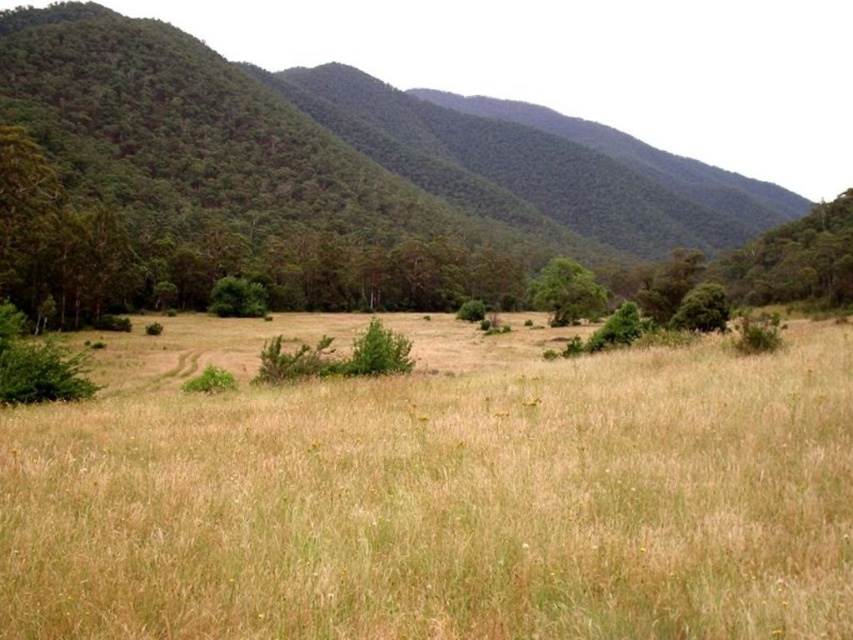
Question: Which object appears farthest from the camera in this image?

Choices:
 (A) green leafy tree at center
 (B) green forested mountain at center
 (C) dry grass at center

Answer: (A)

Question: Does green forested mountain at center have a larger size compared to green leafy tree at center?

Choices:
 (A) no
 (B) yes

Answer: (B)

Question: Among these objects, which one is farthest from the camera?

Choices:
 (A) green leafy tree at center
 (B) dry grass at center

Answer: (A)

Question: Does green forested mountain at center have a greater width compared to green leafy tree at center?

Choices:
 (A) no
 (B) yes

Answer: (B)

Question: Can you confirm if dry grass at center is positioned to the right of green leafy tree at center?

Choices:
 (A) yes
 (B) no

Answer: (B)

Question: Among these objects, which one is farthest from the camera?

Choices:
 (A) green forested mountain at center
 (B) green leafy tree at center
 (C) dry grass at center

Answer: (B)